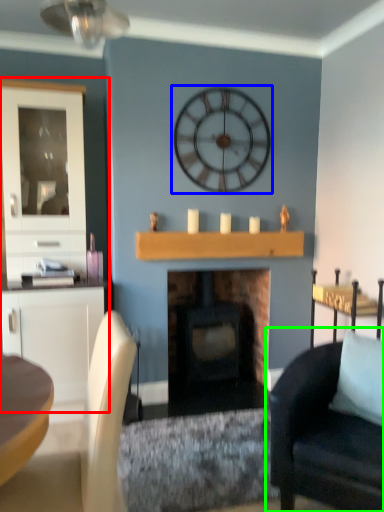
Question: Which object is the farthest from dresser (highlighted by a red box)? Choose among these: wall clock (highlighted by a blue box) or chair (highlighted by a green box).

Choices:
 (A) wall clock
 (B) chair

Answer: (B)